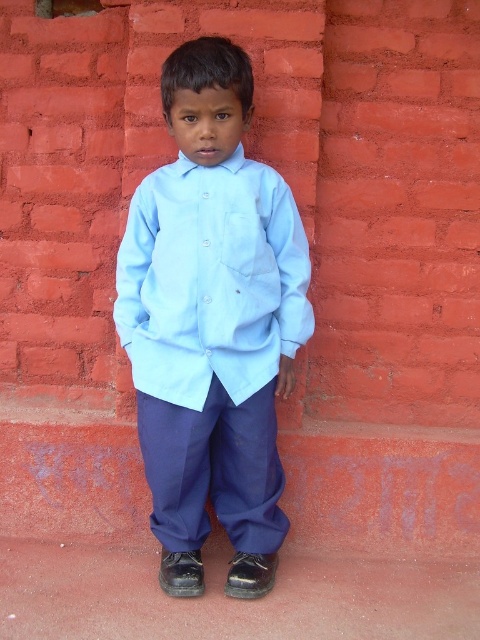
You are a fashion stylist observing a boy dressed in a light blue cotton dress shirt at center and navy blue cotton pants at center. Which clothing item is closer to you?

The light blue cotton dress shirt at center is closer to you because it is in front of the navy blue cotton pants at center.

You are a tailor measuring a customer for a new outfit. The customer is wearing a light blue cotton dress shirt at center and navy blue cotton pants at center. The shirt is currently 10.52 inches away from the pants. If the ideal distance between the shirt and pants should be 12 inches for a proper fit, how much longer should the shirt be adjusted?

The light blue cotton dress shirt at center is currently 10.52 inches away from the navy blue cotton pants at center. To reach the ideal 12 inches, the shirt needs to be lengthened by 1.48 inches.